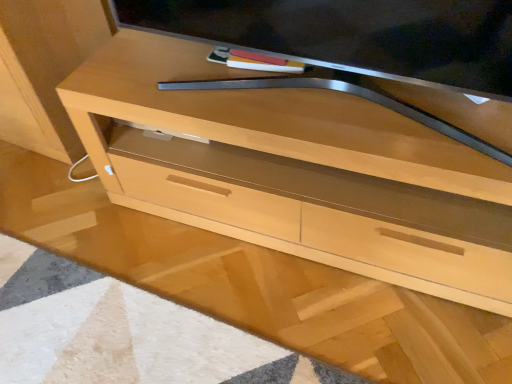
You are a GUI agent. You are given a task and a screenshot of the screen. Output one action in this format:
    pyautogui.click(x=<x>, y=<y>)
    Task: Click on the satin silver tv at upper center
    
    Given the screenshot: What is the action you would take?
    pyautogui.click(x=353, y=35)

What do you see at coordinates (353, 35) in the screenshot? I see `satin silver tv at upper center` at bounding box center [353, 35].

Describe the element at coordinates (297, 171) in the screenshot. I see `light wood chest of drawers at center` at that location.

In order to face light wood chest of drawers at center, should I rotate leftwards or rightwards?

To align with it, rotate right about 6.924°.

You are a GUI agent. You are given a task and a screenshot of the screen. Output one action in this format:
    pyautogui.click(x=<x>, y=<y>)
    Task: Click on the light wood chest of drawers at center
    Image resolution: width=512 pixels, height=384 pixels.
    Given the screenshot: What is the action you would take?
    pyautogui.click(x=297, y=171)

Find the location of a particular element. Image resolution: width=512 pixels, height=384 pixels. satin silver tv at upper center is located at coordinates (353, 35).

Which object is positioned more to the right, light wood chest of drawers at center or satin silver tv at upper center?

From the viewer's perspective, light wood chest of drawers at center appears more on the right side.

Is light wood chest of drawers at center in front of or behind satin silver tv at upper center in the image?

In the image, light wood chest of drawers at center appears behind satin silver tv at upper center.

Considering the points (490, 117) and (320, 63), which point is in front, point (490, 117) or point (320, 63)?

The point (490, 117) is in front.

From the image's perspective, which object appears higher, light wood chest of drawers at center or satin silver tv at upper center?

satin silver tv at upper center.

From a real-world perspective, between light wood chest of drawers at center and satin silver tv at upper center, who is vertically lower?

light wood chest of drawers at center, from a real-world perspective.

Considering the sizes of objects light wood chest of drawers at center and satin silver tv at upper center in the image provided, who is wider, light wood chest of drawers at center or satin silver tv at upper center?

light wood chest of drawers at center.

Between light wood chest of drawers at center and satin silver tv at upper center, which one has less height?

With less height is satin silver tv at upper center.

Between light wood chest of drawers at center and satin silver tv at upper center, which one has smaller size?

With smaller size is satin silver tv at upper center.

Would you say light wood chest of drawers at center contains satin silver tv at upper center?

No, satin silver tv at upper center is not surrounded by light wood chest of drawers at center.

Is the surface of light wood chest of drawers at center in direct contact with satin silver tv at upper center?

No, light wood chest of drawers at center is not making contact with satin silver tv at upper center.

Is light wood chest of drawers at center positioned with its back to satin silver tv at upper center?

No, satin silver tv at upper center is not at the back of light wood chest of drawers at center.

How many degrees apart are the facing directions of light wood chest of drawers at center and satin silver tv at upper center?

light wood chest of drawers at center and satin silver tv at upper center are facing 2.6 degrees away from each other.

Locate an element on the screen. chest of drawers below the satin silver tv at upper center (from a real-world perspective) is located at coordinates (297, 171).

Which is more to the left, satin silver tv at upper center or light wood chest of drawers at center?

satin silver tv at upper center is more to the left.

Which object is closer to the camera taking this photo, satin silver tv at upper center or light wood chest of drawers at center?

satin silver tv at upper center is closer to the camera.

Which is in front, point (408, 1) or point (135, 107)?

Positioned in front is point (408, 1).

From the image's perspective, is satin silver tv at upper center on top of light wood chest of drawers at center?

Correct, satin silver tv at upper center appears higher than light wood chest of drawers at center in the image.

Consider the image. From a real-world perspective, which is physically above, satin silver tv at upper center or light wood chest of drawers at center?

From a 3D spatial view, satin silver tv at upper center is above.

Can you confirm if satin silver tv at upper center is thinner than light wood chest of drawers at center?

Indeed, satin silver tv at upper center has a lesser width compared to light wood chest of drawers at center.

Considering the sizes of objects satin silver tv at upper center and light wood chest of drawers at center in the image provided, who is taller, satin silver tv at upper center or light wood chest of drawers at center?

Standing taller between the two is light wood chest of drawers at center.

In the scene shown: Considering the sizes of objects satin silver tv at upper center and light wood chest of drawers at center in the image provided, who is smaller, satin silver tv at upper center or light wood chest of drawers at center?

With smaller size is satin silver tv at upper center.

Is satin silver tv at upper center positioned beyond the bounds of light wood chest of drawers at center?

Yes.

Are satin silver tv at upper center and light wood chest of drawers at center located far from each other?

No, satin silver tv at upper center is in close proximity to light wood chest of drawers at center.

Is satin silver tv at upper center turned away from light wood chest of drawers at center?

satin silver tv at upper center is not turned away from light wood chest of drawers at center.

How many degrees apart are the facing directions of satin silver tv at upper center and light wood chest of drawers at center?

2.6 degrees separate the facing orientations of satin silver tv at upper center and light wood chest of drawers at center.

The width and height of the screenshot is (512, 384). Identify the location of television above the light wood chest of drawers at center (from the image's perspective). point(353,35).

The width and height of the screenshot is (512, 384). I want to click on the chest of drawers below the satin silver tv at upper center (from the image's perspective), so click(297, 171).

In the image, there is a light wood chest of drawers at center. Where is `television above it (from the image's perspective)`? The height and width of the screenshot is (384, 512). television above it (from the image's perspective) is located at coordinates (353, 35).